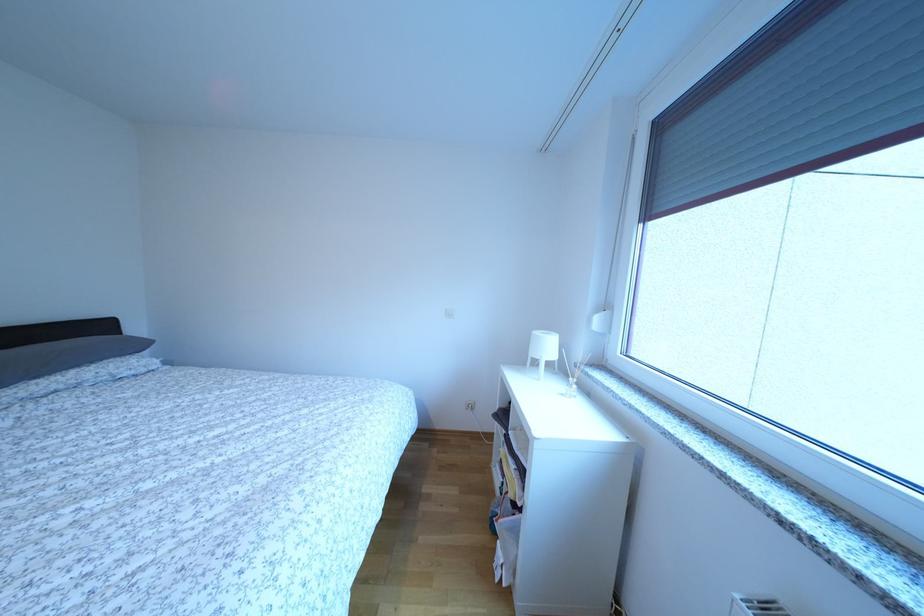
In order to click on white blind strap in this screenshot , I will do `click(596, 62)`.